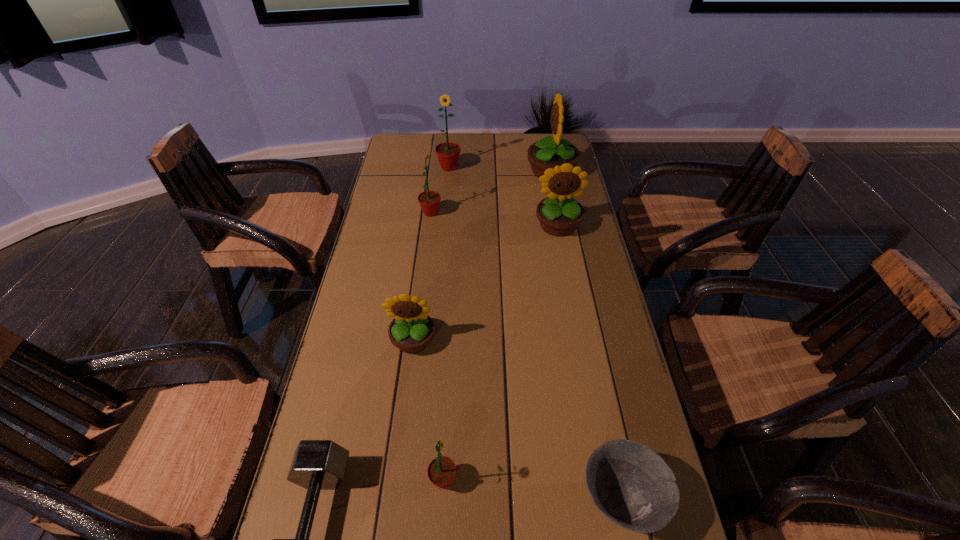
This screenshot has width=960, height=540. I want to click on blank space located 0.320m on the face of the farthest yellow sunflower, so click(444, 171).

Where is `vacant area situated 0.280m on the face of the biggest green sunflower`? The height and width of the screenshot is (540, 960). vacant area situated 0.280m on the face of the biggest green sunflower is located at coordinates (444, 220).

Locate an element on the screen. The width and height of the screenshot is (960, 540). vacant space located on the face of the second farthest yellow sunflower is located at coordinates (568, 283).

The image size is (960, 540). I want to click on free space located on the face of the second smallest green sunflower, so (542, 213).

The width and height of the screenshot is (960, 540). I want to click on vacant space situated 0.120m on the face of the fifth farthest object, so click(405, 402).

This screenshot has height=540, width=960. In order to click on blank space located 0.180m on the face of the smallest green sunflower in this screenshot , I will do `click(544, 480)`.

The width and height of the screenshot is (960, 540). Find the location of `object located at the far right corner`. object located at the far right corner is located at coordinates (548, 152).

This screenshot has width=960, height=540. Identify the location of vacant space at the far edge of the desktop. [x=435, y=142].

Image resolution: width=960 pixels, height=540 pixels. In the image, there is a desktop. In order to click on free region at the left edge in this screenshot , I will do `click(335, 354)`.

Find the location of a particular element. Image resolution: width=960 pixels, height=540 pixels. vacant space at the right edge of the desktop is located at coordinates (582, 240).